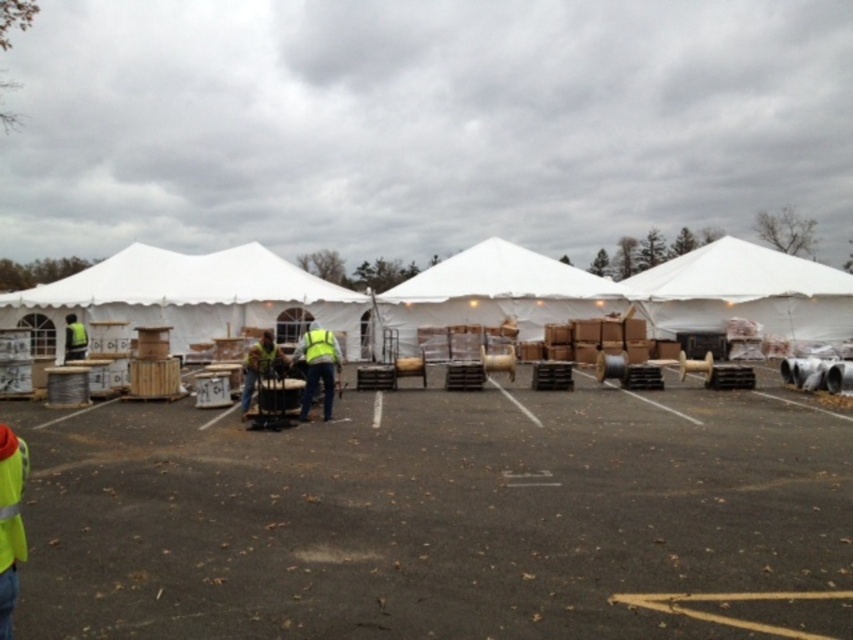
Question: Where is black asphalt parking lot at center located in relation to white fabric tent at center in the image?

Choices:
 (A) left
 (B) right

Answer: (A)

Question: Is reflective yellow vest at center smaller than reflective yellow vest at left?

Choices:
 (A) yes
 (B) no

Answer: (B)

Question: Which object is farther from the camera taking this photo?

Choices:
 (A) reflective yellow vest at center
 (B) reflective yellow vest at left

Answer: (B)

Question: Is reflective yellow vest at center to the left of yellow reflective vest at center from the viewer's perspective?

Choices:
 (A) no
 (B) yes

Answer: (A)

Question: Which point is farther to the camera?

Choices:
 (A) (78, 349)
 (B) (80, 275)
 (C) (10, 508)

Answer: (B)

Question: Which point is closer to the camera taking this photo?

Choices:
 (A) (x=492, y=298)
 (B) (x=260, y=592)
 (C) (x=210, y=289)

Answer: (B)